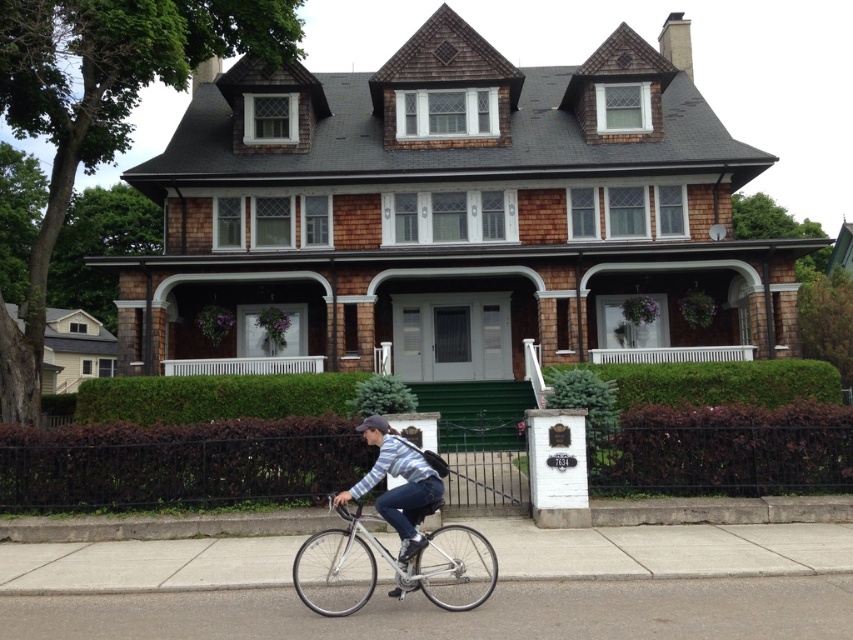
Question: Considering the relative positions of silver metallic bicycle at lower center and striped cotton shirt at center in the image provided, where is silver metallic bicycle at lower center located with respect to striped cotton shirt at center?

Choices:
 (A) below
 (B) above

Answer: (A)

Question: Which point appears closest to the camera in this image?

Choices:
 (A) (466, 536)
 (B) (404, 483)

Answer: (B)

Question: Does silver metallic bicycle at lower center have a lesser width compared to striped cotton shirt at center?

Choices:
 (A) yes
 (B) no

Answer: (B)

Question: Is silver metallic bicycle at lower center positioned before striped cotton shirt at center?

Choices:
 (A) no
 (B) yes

Answer: (B)

Question: Which point is closer to the camera?

Choices:
 (A) silver metallic bicycle at lower center
 (B) striped cotton shirt at center

Answer: (A)